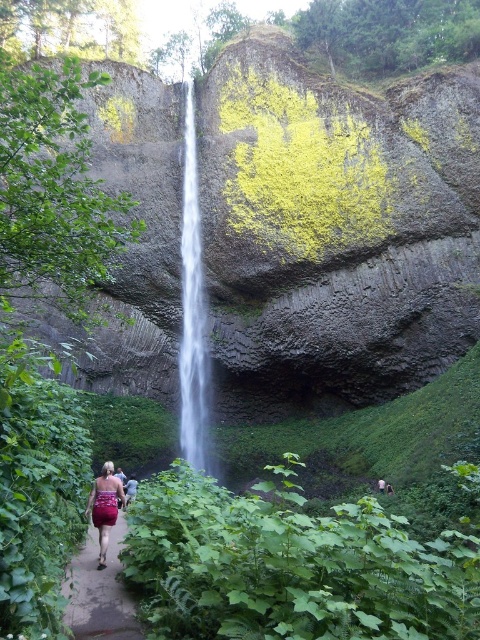
You are standing at the base of the waterfall and want to walk towards the pathway that leads away from the waterfall. Which point, point (x=327, y=540) or point (x=189, y=97), is closer to you as you start walking?

Point (x=327, y=540) is closer to the viewer than point (x=189, y=97), so you should head towards point (x=327, y=540) first.

You are a hiker who wants to take a photo of the dark brown leather jacket at lower center without the green leafy shrub at upper left blocking the view. Where should you position yourself relative to the jacket?

The green leafy shrub at upper left is positioned over the dark brown leather jacket at lower center. To avoid the shrub blocking the view, you should position yourself below the jacket, facing upwards so that the shrub is out of the frame.

Consider the image. You are standing at the base of the waterfall in the image. You see a point marked at coordinates point (54, 193). Where is this point located relative to the green leafy shrub at upper left?

The point (54, 193) is located on the green leafy shrub at upper left.